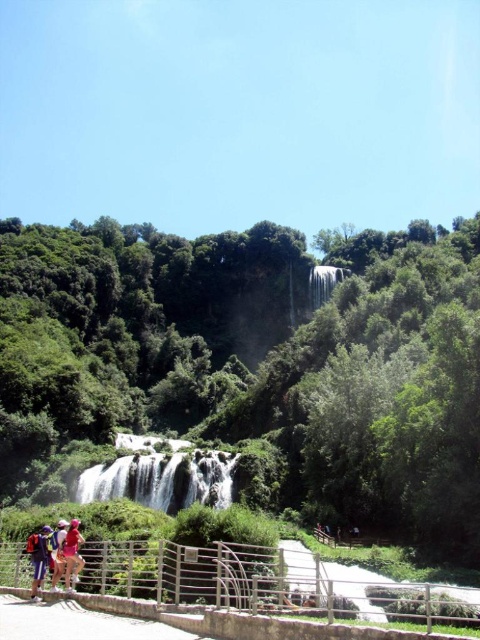
Question: Based on their relative distances, which object is nearer to the matte purple shorts at lower left?

Choices:
 (A) silver metallic rail at lower center
 (B) matte pink backpack at lower left

Answer: (B)

Question: Can you confirm if white smooth waterfall at upper center is positioned to the left of matte pink shirt at lower left?

Choices:
 (A) no
 (B) yes

Answer: (A)

Question: Estimate the real-world distances between objects in this image. Which object is closer to the matte pink shirt at lower left?

Choices:
 (A) white frothy water at center
 (B) white smooth waterfall at upper center

Answer: (A)

Question: Can you confirm if white smooth waterfall at upper center is positioned below matte purple shorts at lower left?

Choices:
 (A) yes
 (B) no

Answer: (B)

Question: Is white frothy water at center further to the viewer compared to matte pink shirt at lower left?

Choices:
 (A) no
 (B) yes

Answer: (B)

Question: Which is farther from the white frothy water at center?

Choices:
 (A) white smooth waterfall at upper center
 (B) matte pink shirt at lower left

Answer: (A)